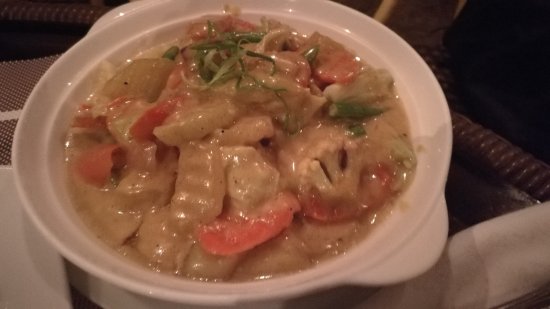
This screenshot has width=550, height=309. In order to click on rim of bowl in this screenshot , I will do `click(411, 47)`.